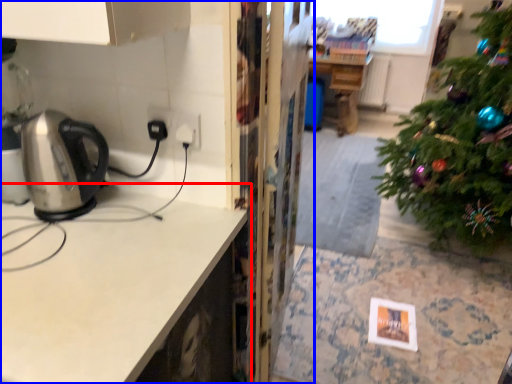
Question: Among these objects, which one is farthest to the camera, countertop (highlighted by a red box) or cabinetry (highlighted by a blue box)?

Choices:
 (A) countertop
 (B) cabinetry

Answer: (B)